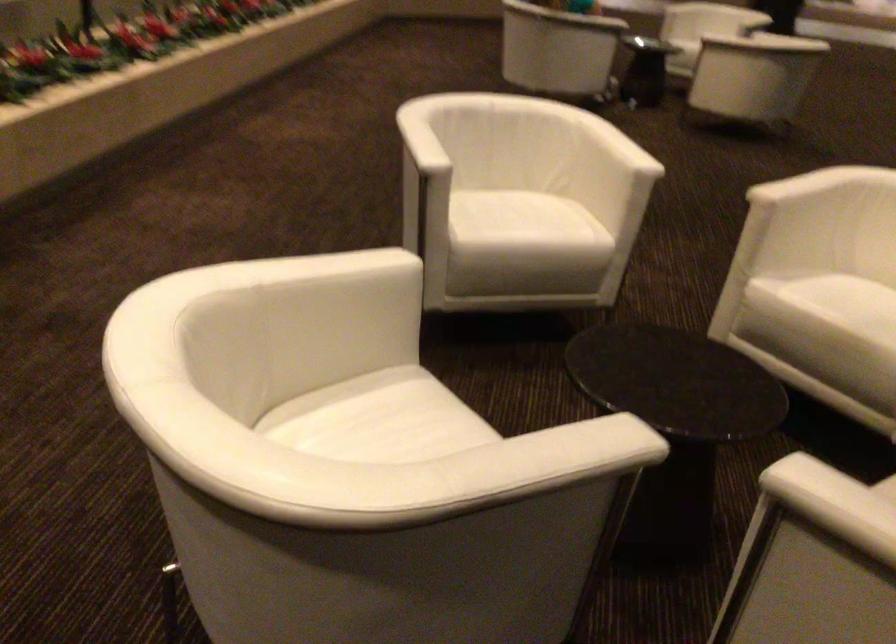
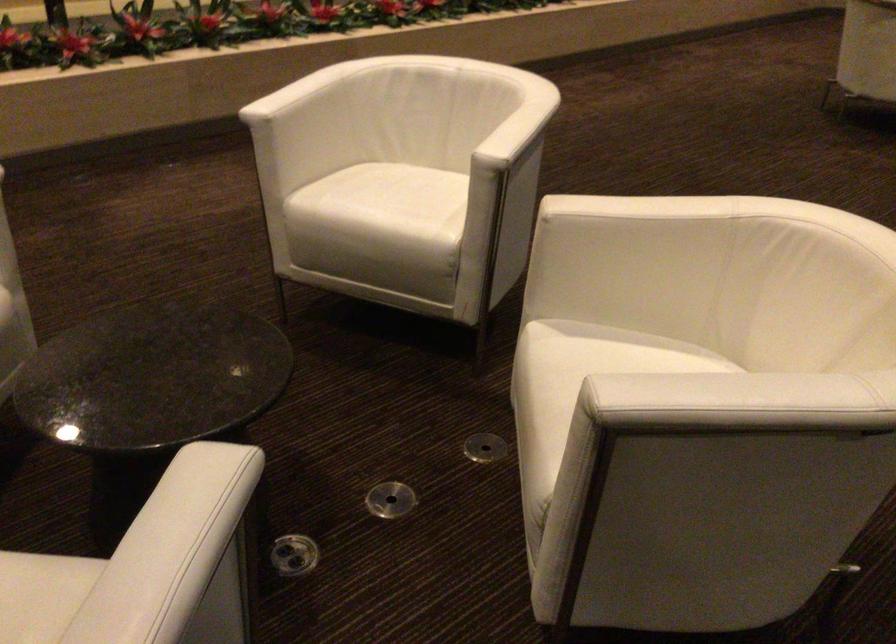
Locate, in the second image, the point that corresponds to pixel 685 384 in the first image.

(152, 377)